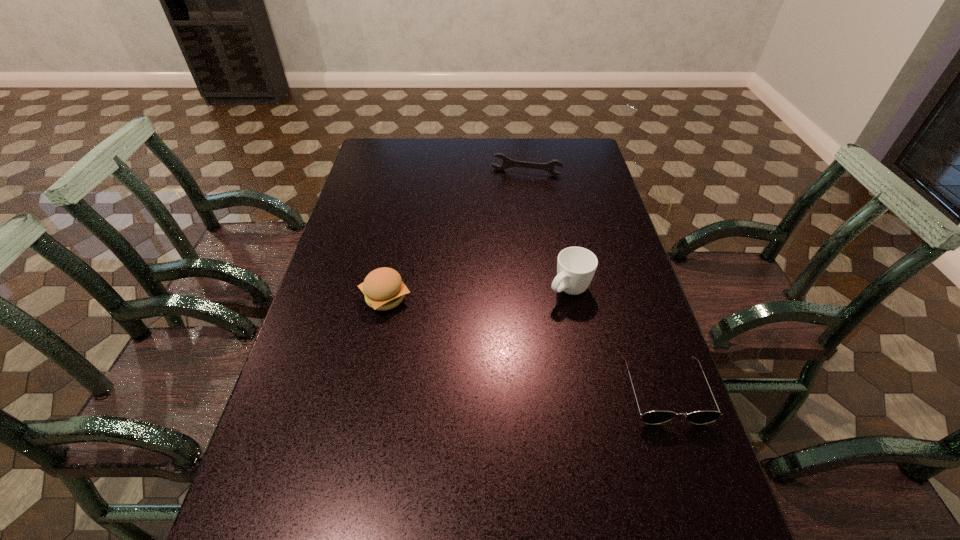
Where is `hamburger`? The height and width of the screenshot is (540, 960). hamburger is located at coordinates (383, 288).

Identify the location of the leftmost object. (383, 288).

Image resolution: width=960 pixels, height=540 pixels. Find the location of `the nearest object`. the nearest object is located at coordinates (652, 417).

What are the coordinates of `sunglasses` in the screenshot? It's located at (652, 417).

You are a GUI agent. You are given a task and a screenshot of the screen. Output one action in this format:
    pyautogui.click(x=<x>, y=<y>)
    Task: Click on the wrench
    The image size is (960, 540).
    Given the screenshot: What is the action you would take?
    pyautogui.click(x=507, y=162)

You are a GUI agent. You are given a task and a screenshot of the screen. Output one action in this format:
    pyautogui.click(x=<x>, y=<y>)
    Task: Click on the cup
    Image resolution: width=960 pixels, height=540 pixels.
    Given the screenshot: What is the action you would take?
    pyautogui.click(x=576, y=266)

What are the coordinates of `free space located 0.100m on the back of the leftmost object` in the screenshot? It's located at (395, 256).

The width and height of the screenshot is (960, 540). I want to click on blank space located 0.130m on the front-facing side of the nearest object, so click(697, 488).

The image size is (960, 540). Find the location of `vacant space located 0.260m on the open ends of the wrench`. vacant space located 0.260m on the open ends of the wrench is located at coordinates (508, 219).

Locate an element on the screen. free location located 0.110m on the open ends of the wrench is located at coordinates (516, 194).